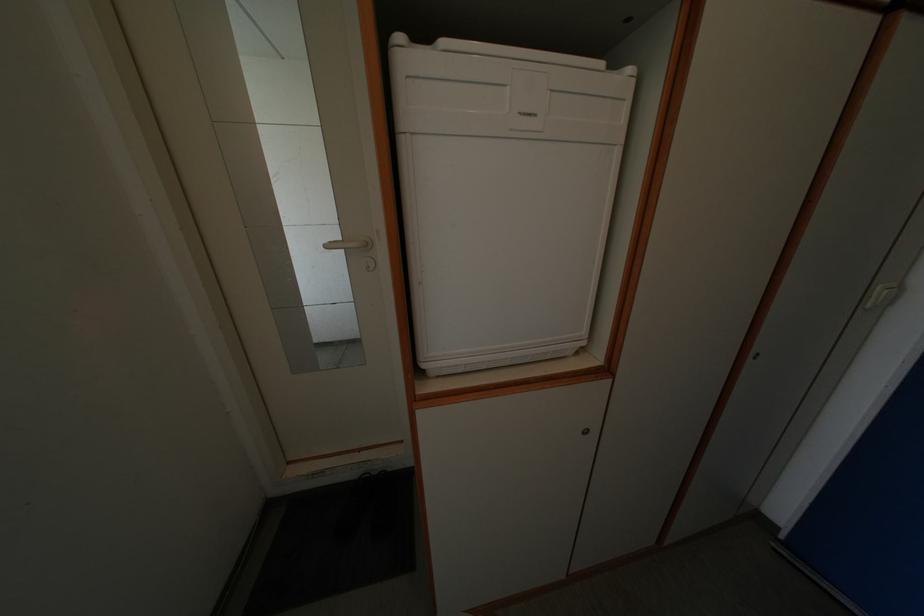
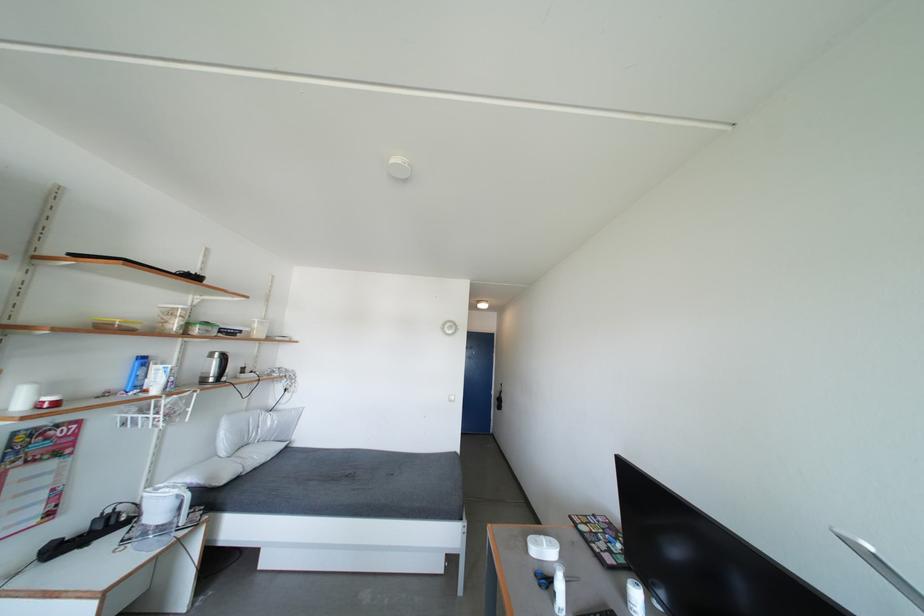
Question: I am providing you with two images of the same scene from different viewpoints. Which of the following objects are not visible in image2?

Choices:
 (A) white light switch
 (B) blue bottle
 (C) black luggage handle
 (D) white pillow

Answer: (A)